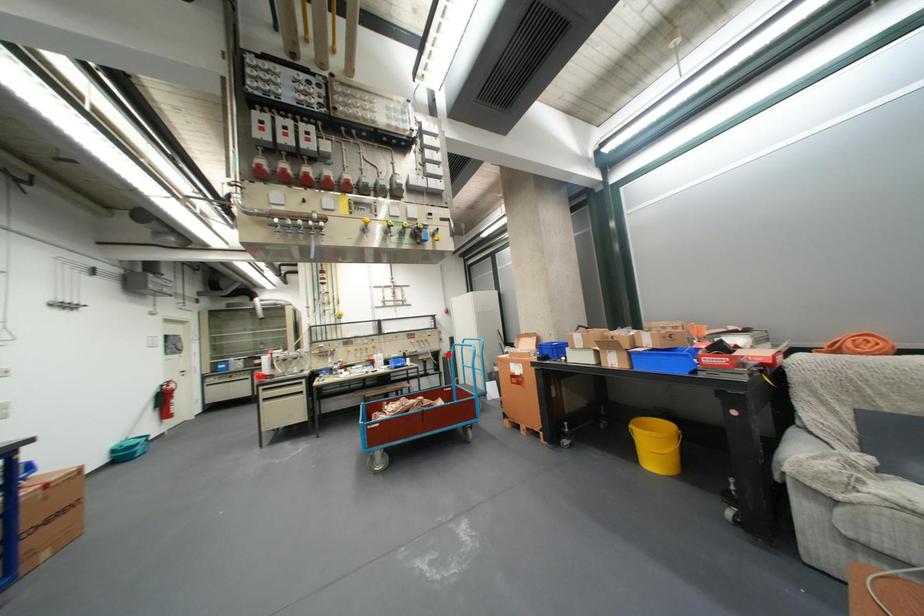
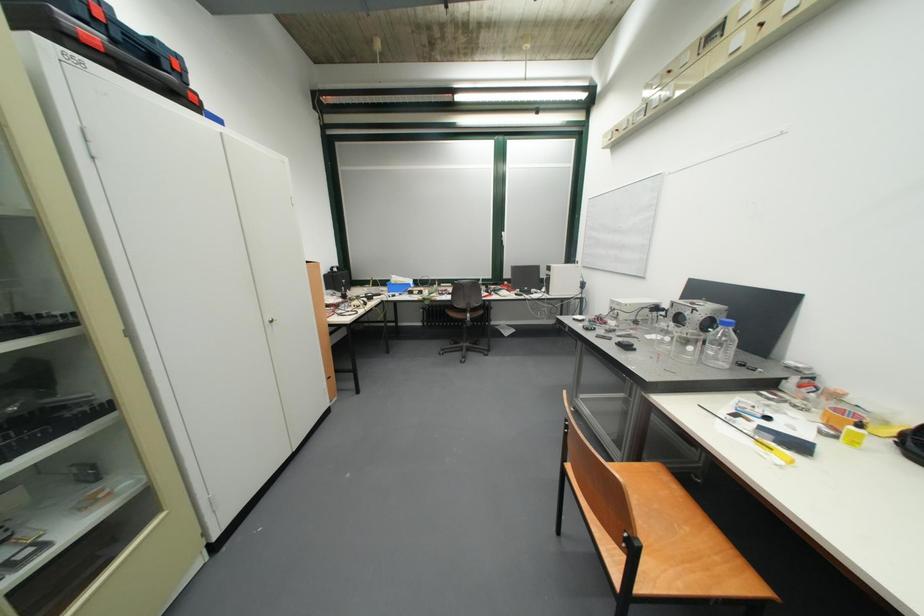
Question: I am providing you with two images of the same scene from different viewpoints. A red point is marked on the first image. At the location where the point appears in image 1, is it still visible in image 2?

Choices:
 (A) Yes
 (B) No

Answer: (B)